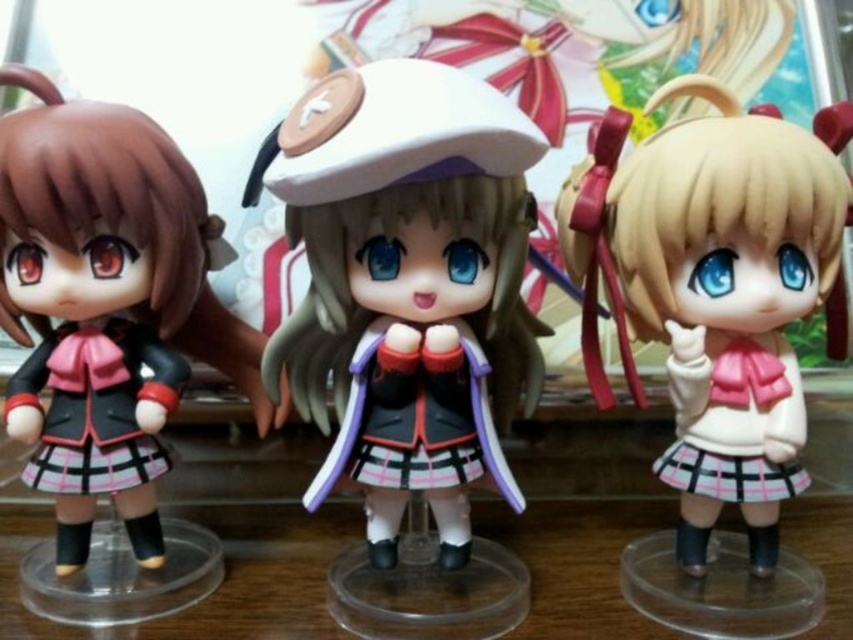
Question: Is the position of satin white beret at center more distant than that of matte black school uniform at left?

Choices:
 (A) yes
 (B) no

Answer: (B)

Question: Which of the following is the closest to the observer?

Choices:
 (A) (183, 211)
 (B) (682, 333)
 (C) (299, 580)
 (D) (405, 228)

Answer: (B)

Question: Which point is closer to the camera?

Choices:
 (A) satin white beret at center
 (B) matte black doll at left
 (C) matte black school uniform at left
 (D) matte pink skirt at center

Answer: (A)

Question: Which point appears farthest from the camera in this image?

Choices:
 (A) (154, 145)
 (B) (115, 486)
 (C) (791, 266)

Answer: (B)

Question: Does matte pink skirt at center appear on the left side of matte black doll at left?

Choices:
 (A) no
 (B) yes

Answer: (A)

Question: Is matte pink skirt at center bigger than transparent plastic table at center?

Choices:
 (A) no
 (B) yes

Answer: (A)